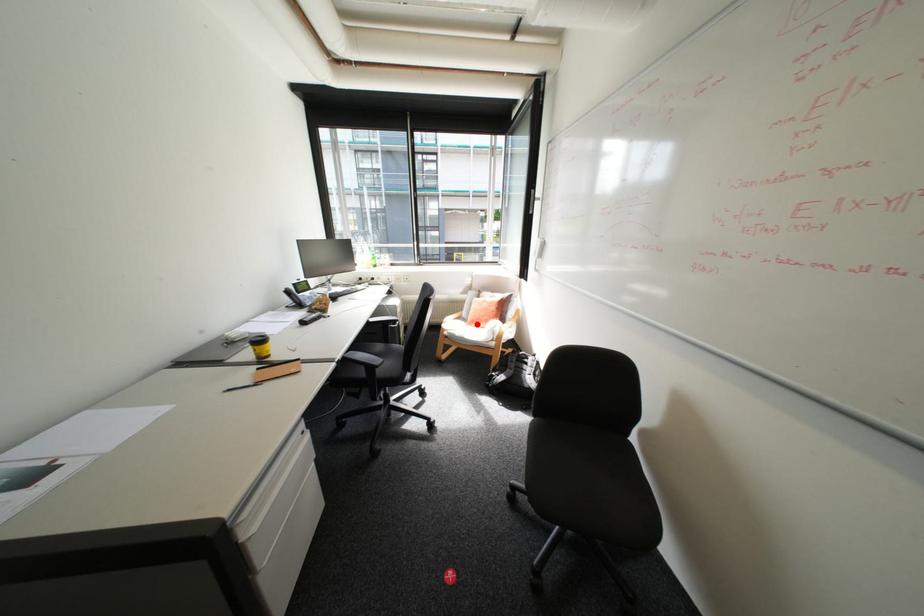
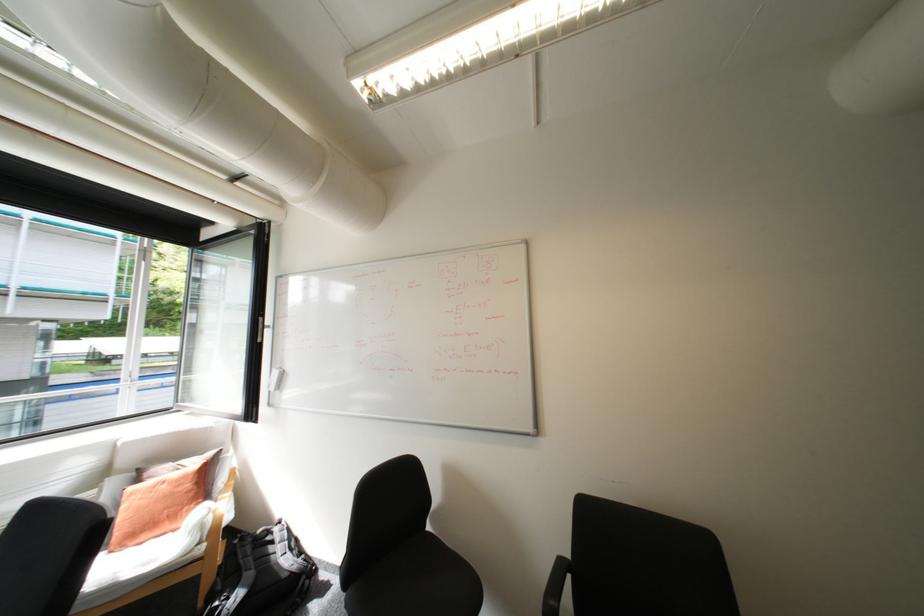
The point at the highlighted location is marked in the first image. Where is the corresponding point in the second image?

(122, 552)